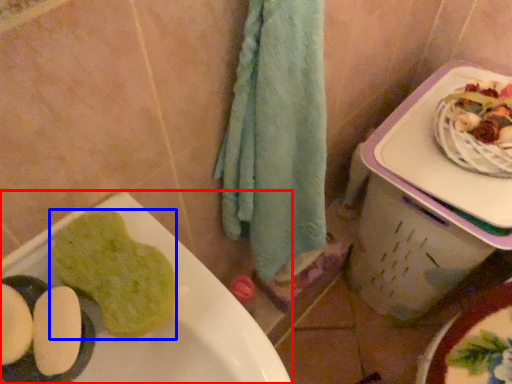
Question: Among these objects, which one is farthest to the camera, sink (highlighted by a red box) or food (highlighted by a blue box)?

Choices:
 (A) sink
 (B) food

Answer: (B)